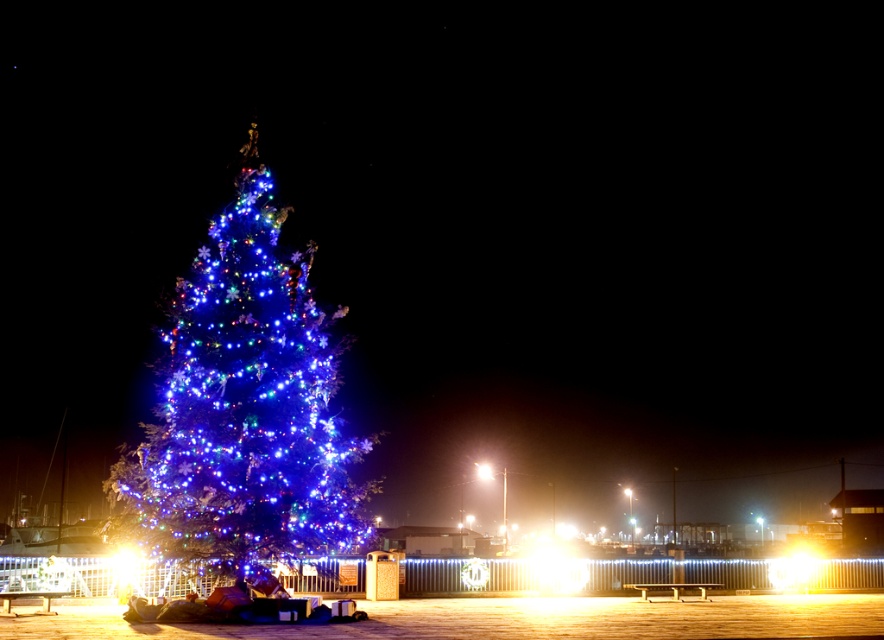
You are standing at the edge of the wooden deck and want to place a new decoration exactly at the position of the illuminated blue lights at center. What are the coordinates where you should place it?

The illuminated blue lights at center are located at coordinates point (244,404), so you should place the new decoration there.

You are setting up a Christmas tree and want to ensure the decorations are balanced. You have the illuminated blue lights at center and the bright white light at center. Which decoration has a wider spread when viewed from the front?

The illuminated blue lights at center has a wider spread when viewed from the front since its width is larger than the bright white light at center.